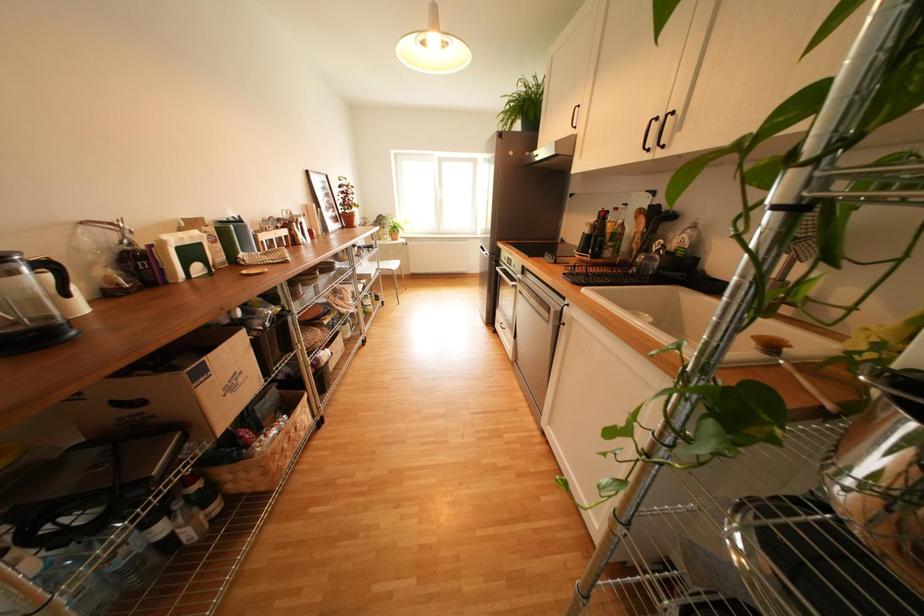
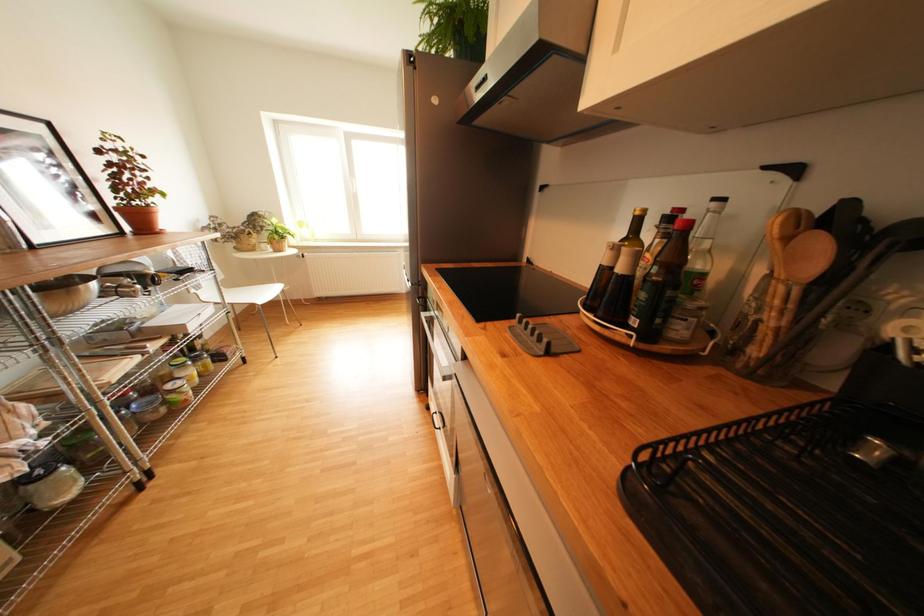
Question: In a continuous first-person perspective shot, in which direction is the camera moving?

Choices:
 (A) Left
 (B) Right
 (C) Forward
 (D) Backward

Answer: (C)